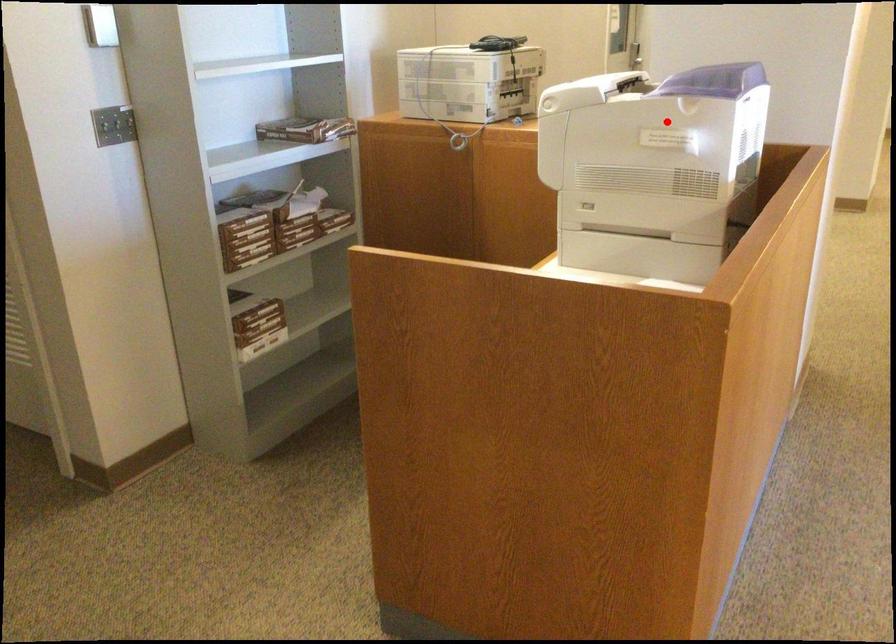
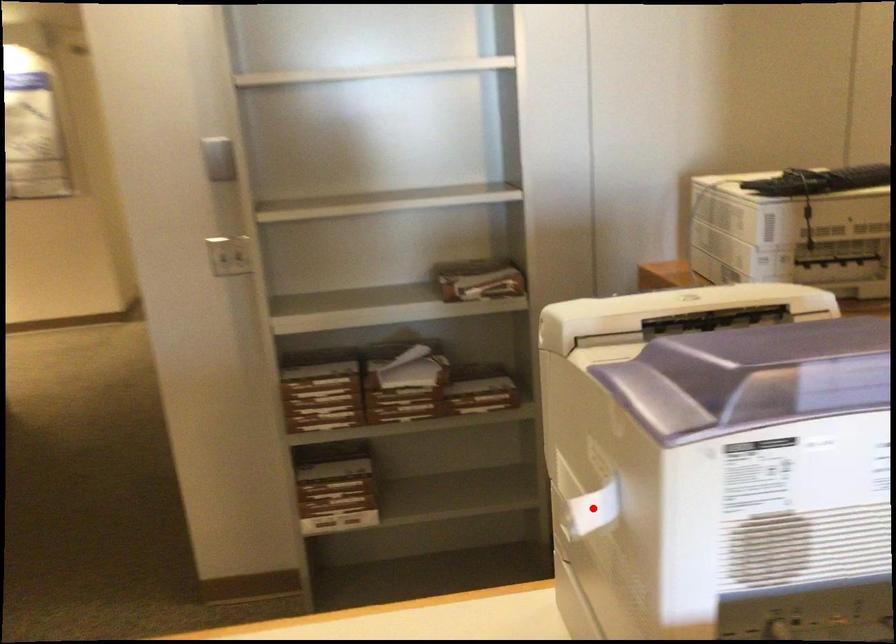
I am providing you with two images of the same scene from different viewpoints. A red point is marked on the first image and another point is marked on the second image. Is the red point in image1 aligned with the point shown in image2?

Yes